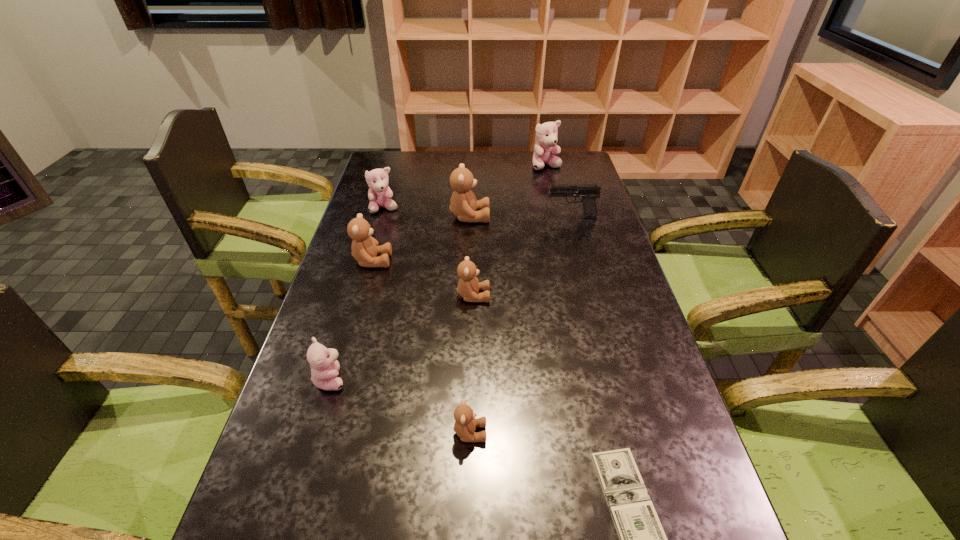
This screenshot has height=540, width=960. I want to click on vacant space situated on the face of the fourth nearest object, so click(x=624, y=296).

You are a GUI agent. You are given a task and a screenshot of the screen. Output one action in this format:
    pyautogui.click(x=<x>, y=<y>)
    Task: Click on the free space located 0.330m at the face of the second nearest teddy bear
    
    Given the screenshot: What is the action you would take?
    pyautogui.click(x=491, y=379)

Locate an element on the screen. The image size is (960, 540). free point located on the face of the eighth farthest object is located at coordinates (516, 433).

Locate an element on the screen. Image resolution: width=960 pixels, height=540 pixels. object that is at the far edge is located at coordinates (546, 134).

At what (x,y) coordinates should I click in order to perform the action: click on teddy bear at the right edge. Please return your answer as a coordinate pair (x, y). This screenshot has height=540, width=960. Looking at the image, I should click on (546, 134).

The height and width of the screenshot is (540, 960). In order to click on pistol located in the right edge section of the desktop in this screenshot , I will do 589,192.

The height and width of the screenshot is (540, 960). What are the coordinates of `object that is at the far right corner` in the screenshot? It's located at (546, 134).

Where is `free space at the far edge of the desktop`? The height and width of the screenshot is (540, 960). free space at the far edge of the desktop is located at coordinates (498, 171).

Locate an element on the screen. The width and height of the screenshot is (960, 540). vacant space at the left edge of the desktop is located at coordinates pos(377,300).

In the image, there is a desktop. Find the location of `free space at the right edge`. free space at the right edge is located at coordinates (664, 416).